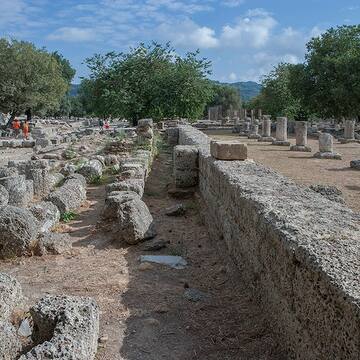
This screenshot has width=360, height=360. I want to click on place to sit, so click(x=296, y=207).